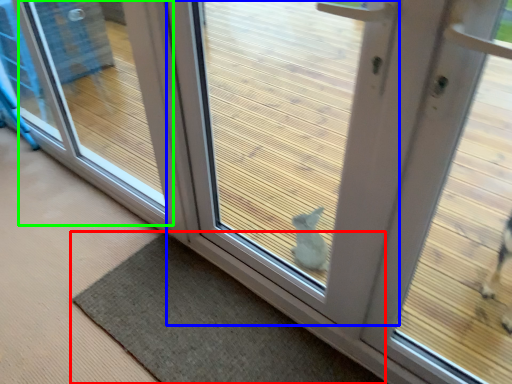
Question: Which is farther away from mat (highlighted by a red box)? door (highlighted by a blue box) or window (highlighted by a green box)?

Choices:
 (A) door
 (B) window

Answer: (B)